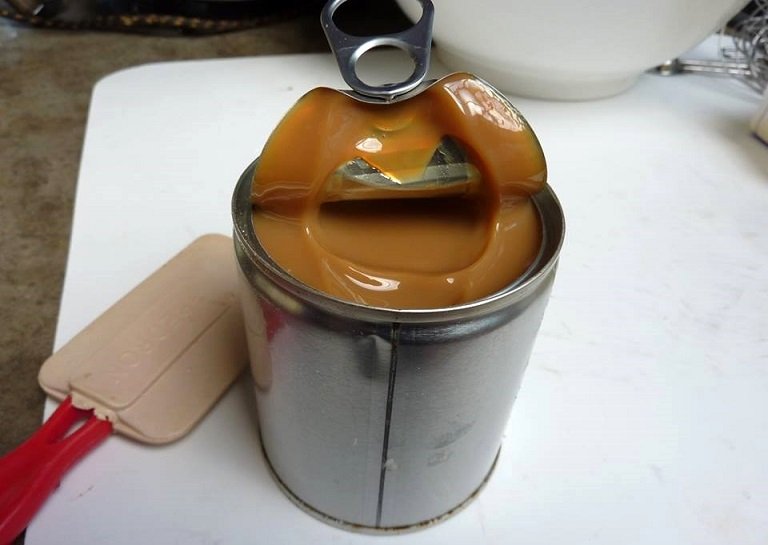
You are a GUI agent. You are given a task and a screenshot of the screen. Output one action in this format:
    pyautogui.click(x=<x>, y=<y>)
    Task: Click on the spatula handle
    
    Given the screenshot: What is the action you would take?
    pyautogui.click(x=25, y=470)